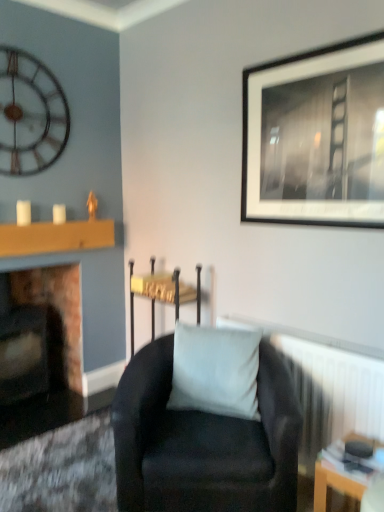
The image size is (384, 512). I want to click on blank space above wooden table at lower right (from a real-world perspective), so click(x=361, y=456).